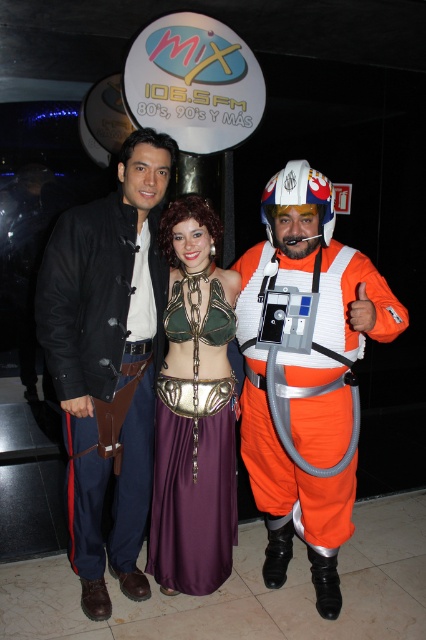
You are at the Mix 106.5 FM event and want to take a photo of the sign. You are standing at point (x=229, y=316). Can you move to point (x=86, y=531) to get a better angle without blocking the sign?

Point (x=86, y=531) is behind point (x=229, y=316), so moving to point (x=86, y=531) would place you behind the current position, potentially blocking the sign less. However, since the sign is in front of both points, you might still have a clear view. Check the layout to ensure no obstructions.

You are a photographer at the event and need to adjust the lighting so that the orange fabric spacesuit at center and the metallic green armor at center are both visible. Which object should you focus on first to ensure proper exposure?

The orange fabric spacesuit at center is positioned over metallic green armor at center, so you should focus on the metallic green armor at center first to ensure proper exposure, as it is underneath and may require more light to be visible through the spacesuit.